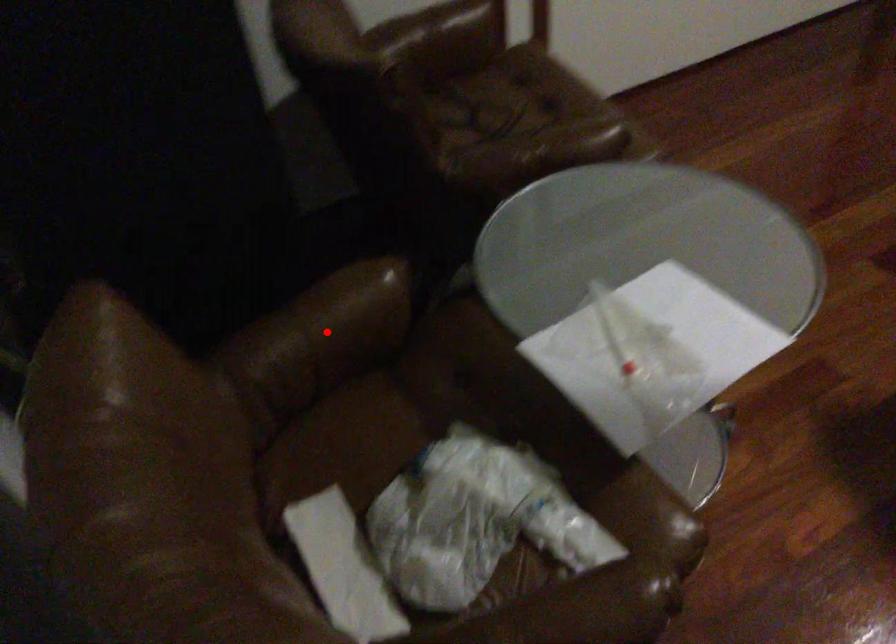
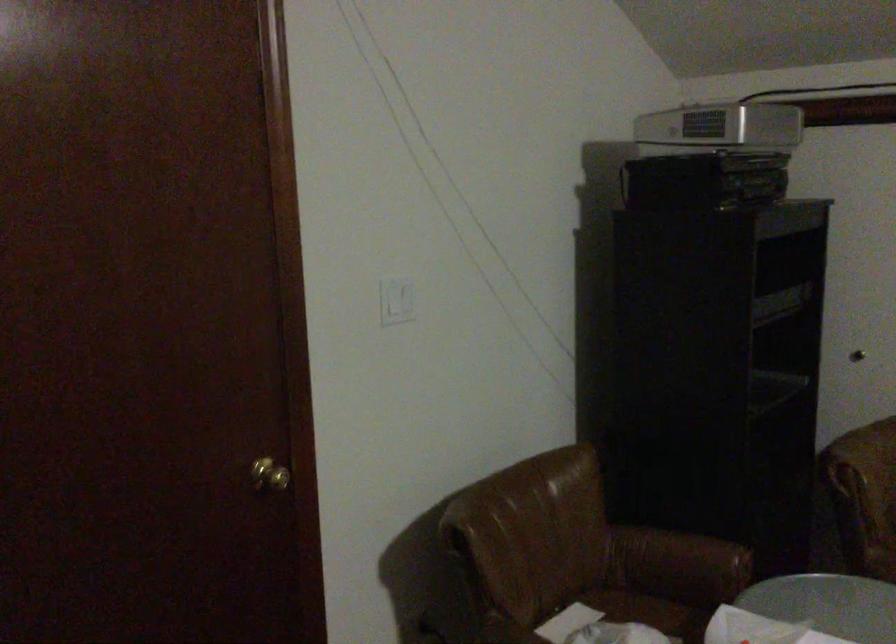
Question: I am providing you with two images of the same scene from different viewpoints. A red point is shown in image1. For the corresponding object point in image2, is it positioned nearer or farther from the camera?

Choices:
 (A) Nearer
 (B) Farther

Answer: (B)